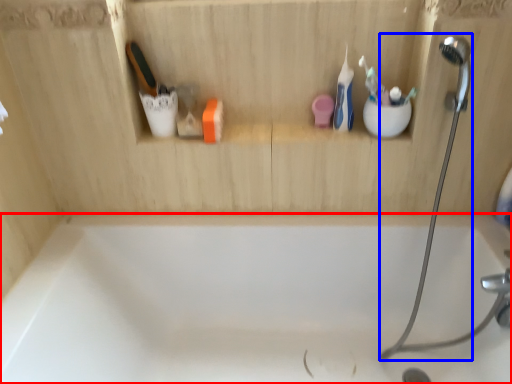
Question: Which object appears farthest to the camera in this image, bathtub (highlighted by a red box) or shower (highlighted by a blue box)?

Choices:
 (A) bathtub
 (B) shower

Answer: (A)